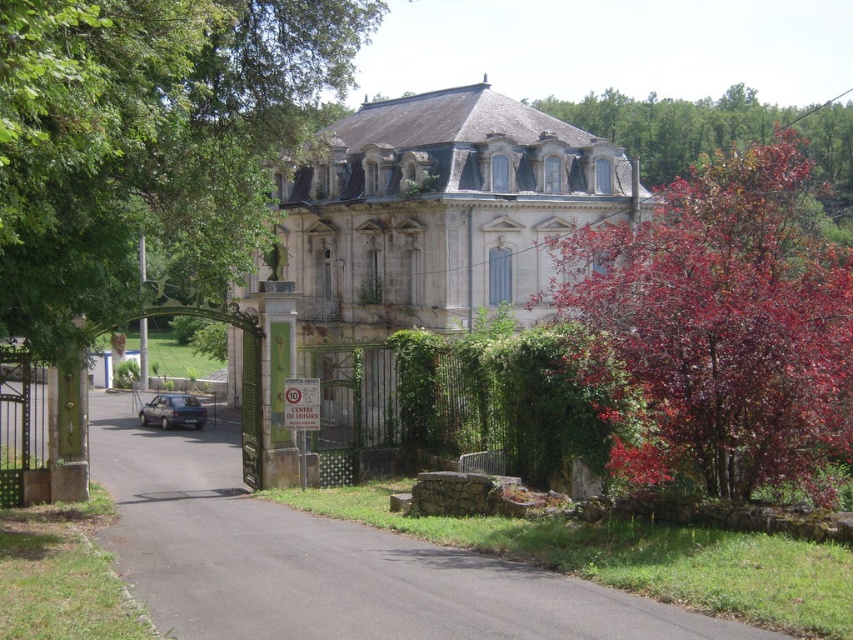
You are standing in front of the grand old building and want to take a photo. You notice two points marked on the image. Which point, point (x=45, y=3) or point (x=838, y=160), is closer to you?

Point (x=45, y=3) is closer to the camera than point (x=838, y=160), so it is closer to you.

You are standing in front of the building and notice the green leafy tree at upper left and the purple leafy tree at upper right. Which tree is positioned lower on the image?

The green leafy tree at upper left is positioned below the purple leafy tree at upper right, so it is lower in the image.